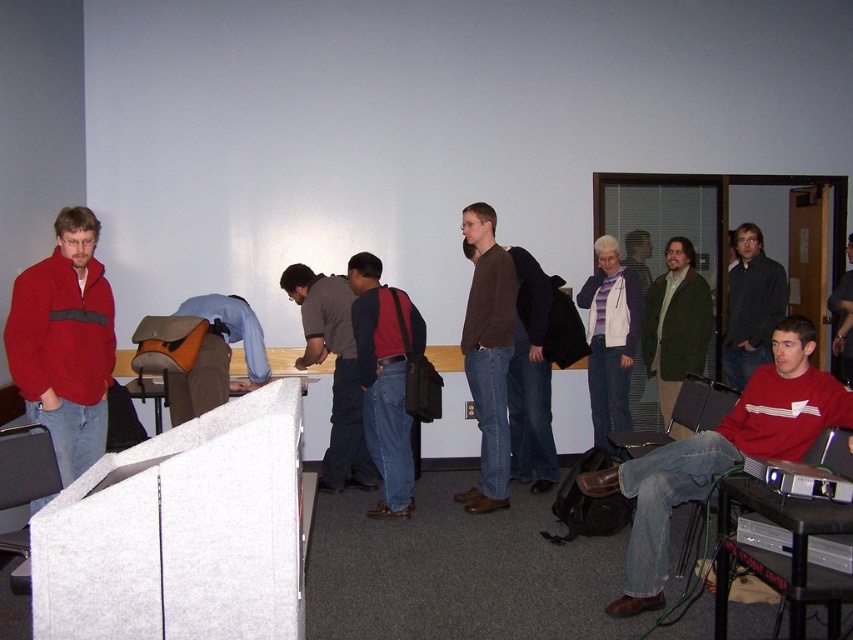
Question: In this image, where is dark red fabric shirt at center located relative to silver metallic computer at lower right?

Choices:
 (A) right
 (B) left

Answer: (B)

Question: Which object is closer to the camera taking this photo?

Choices:
 (A) silver metallic computer at lower right
 (B) brown matte sweater at center
 (C) denim jacket at left
 (D) green woolen jacket at center

Answer: (A)

Question: Which is farther from the matte brown jacket at center?

Choices:
 (A) white fleece jacket at center
 (B) dark gray sweater at center

Answer: (B)

Question: Can you confirm if dark gray fabric shirt at center is positioned below dark gray sweater at center?

Choices:
 (A) no
 (B) yes

Answer: (B)

Question: Is dark red fabric shirt at center to the left of dark blue jeans at center from the viewer's perspective?

Choices:
 (A) no
 (B) yes

Answer: (B)

Question: Which object is farther from the camera taking this photo?

Choices:
 (A) silver metallic computer at lower right
 (B) dark blue jeans at center
 (C) brown matte sweater at center

Answer: (B)